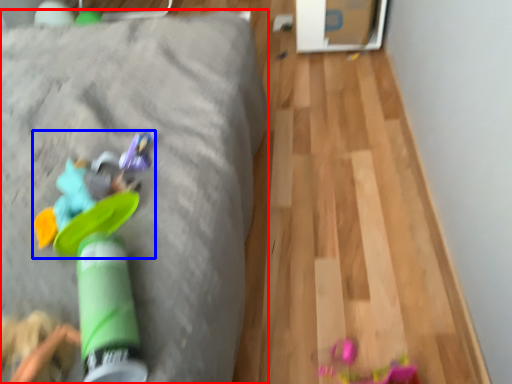
Question: Which of the following is the farthest to the observer, furniture (highlighted by a red box) or toy (highlighted by a blue box)?

Choices:
 (A) furniture
 (B) toy

Answer: (A)